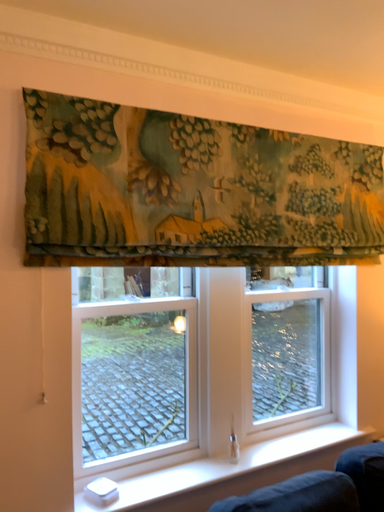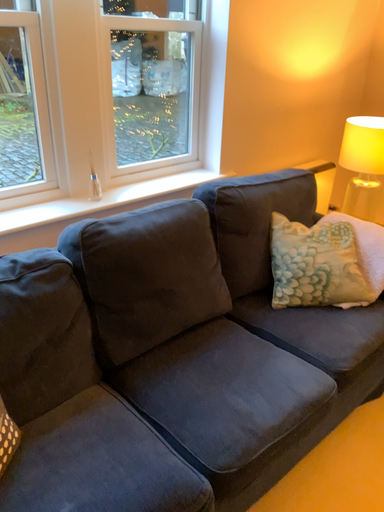
Question: Which way did the camera rotate in the video?

Choices:
 (A) rotated upward
 (B) rotated downward

Answer: (B)